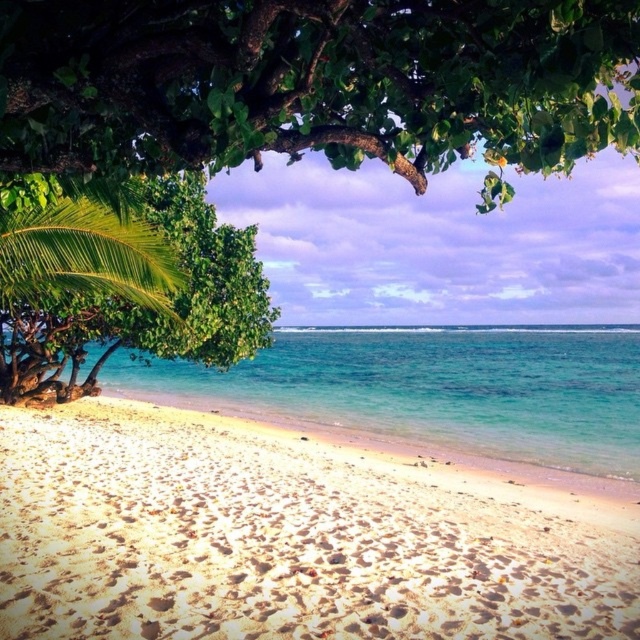
Which is in front, point (344, 572) or point (445, 124)?

Point (445, 124) is in front.

In order to click on white sandy beach at lower center in this screenshot , I will do `click(285, 538)`.

Which is more to the right, green leafy tree at upper center or clear blue water at center?

clear blue water at center

Can you confirm if green leafy tree at upper center is positioned below clear blue water at center?

Actually, green leafy tree at upper center is above clear blue water at center.

Which is in front, point (96, 77) or point (534, 436)?

Positioned in front is point (96, 77).

The width and height of the screenshot is (640, 640). Identify the location of green leafy tree at upper center. (317, 83).

Does point (458, 99) lie in front of point (116, 292)?

That is True.

Is green leafy tree at upper center wider than green leafy palm tree at upper left?

No.

The height and width of the screenshot is (640, 640). What are the coordinates of `green leafy tree at upper center` in the screenshot? It's located at 317,83.